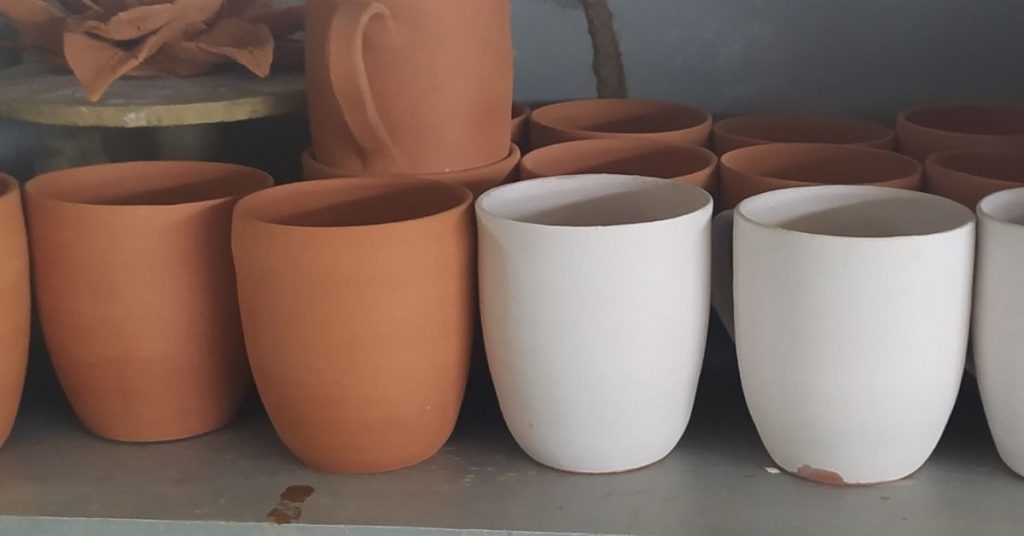
Where is `table`? table is located at coordinates (598, 497).